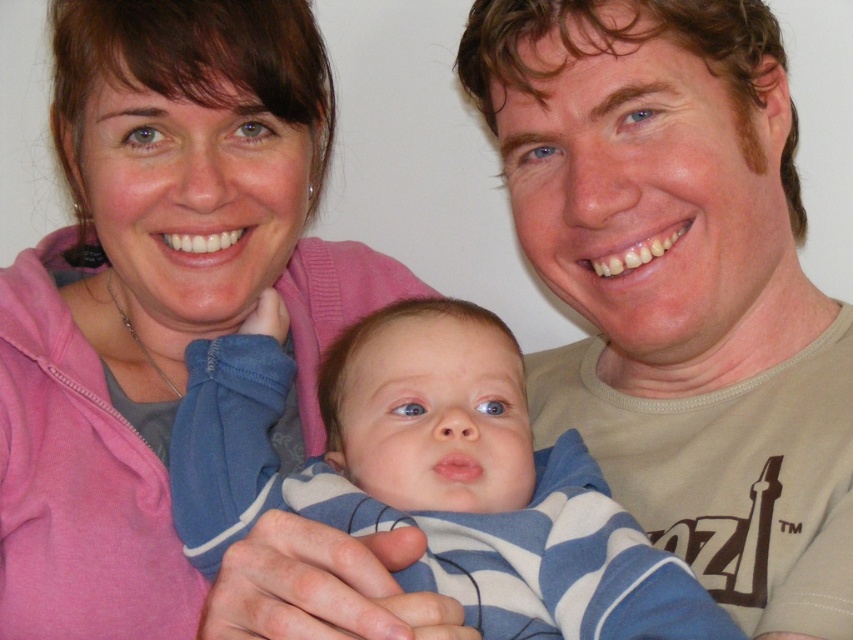
You are a photographer trying to capture a closeup of the baby in the center. You notice two points in the image at coordinates point (38, 397) and point (544, 541). Which point is closer to you and should you focus on for the baby?

Point (38, 397) is closer to you than point (544, 541), so you should focus on point (38, 397) for the baby.

You are a photographer setting up a camera at eye level with the baby. The camera can only focus on objects within a 30 cm height range. Given that the blue striped onesie at center is 20 cm tall, will the pink fleece at upper left also be in focus?

The pink fleece at upper left is taller than the blue striped onesie at center. Since the blue striped onesie at center is 20 cm tall, the pink fleece at upper left must be over 20 cm. However, the camera can only focus on objects within a 30 cm height range. Therefore, the pink fleece at upper left may or may not be within the focus range depending on its exact height. Without knowing the exact height of the pink fleece at upper left, we cannot confirm if it will be in focus.